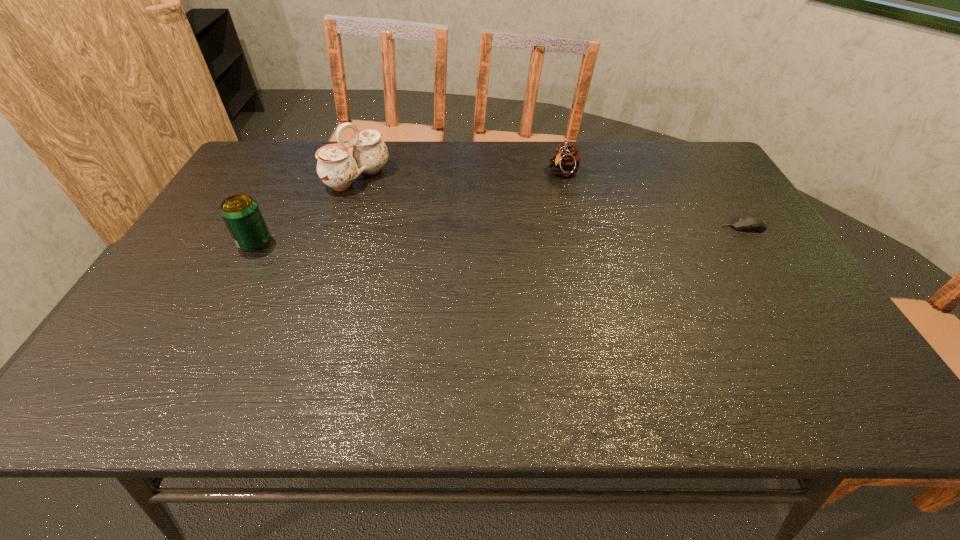
At what (x,y) coordinates should I click in order to perform the action: click on vacant position located 0.300m with a leaf charm attached to the third object from left to right. Please return your answer as a coordinate pair (x, y). The image size is (960, 540). Looking at the image, I should click on (510, 236).

This screenshot has height=540, width=960. What are the coordinates of `vacant space located 0.250m with a leaf charm attached to the third object from left to right` in the screenshot? It's located at (518, 226).

Identify the location of vacant space located with a leaf charm attached to the third object from left to right. (549, 192).

I want to click on free space located by the handle of the tallest object, so click(x=472, y=248).

In order to click on vacant space situated 0.120m by the handle of the tallest object in this screenshot , I will do `click(403, 206)`.

The image size is (960, 540). I want to click on vacant space located 0.160m by the handle of the tallest object, so click(x=413, y=212).

Find the location of `pinecone present at the far edge`. pinecone present at the far edge is located at coordinates (565, 160).

Find the location of a particular element. chinaware that is at the far edge is located at coordinates (339, 164).

At what (x,y) coordinates should I click in order to perform the action: click on object located at the left edge. Please return your answer as a coordinate pair (x, y). The image size is (960, 540). Looking at the image, I should click on (240, 212).

At what (x,y) coordinates should I click in order to perform the action: click on object positioned at the right edge. Please return your answer as a coordinate pair (x, y). Looking at the image, I should click on (753, 223).